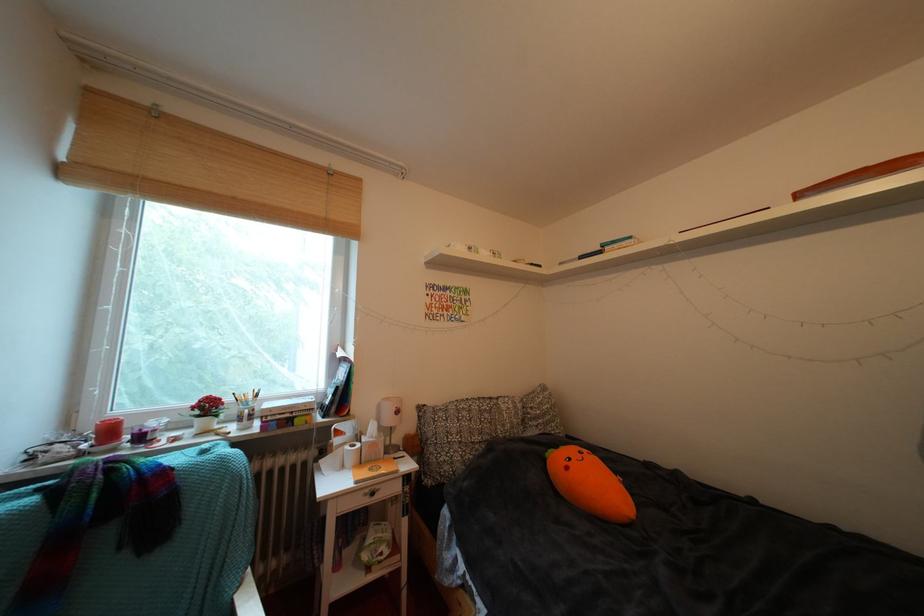
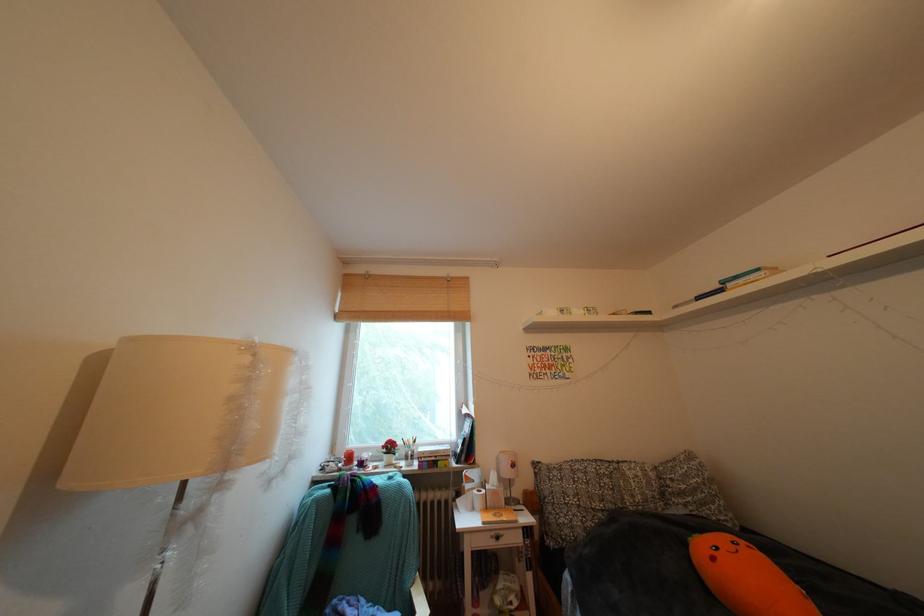
Locate, in the second image, the point that corresponds to the point at 541,413 in the first image.

(682, 485)